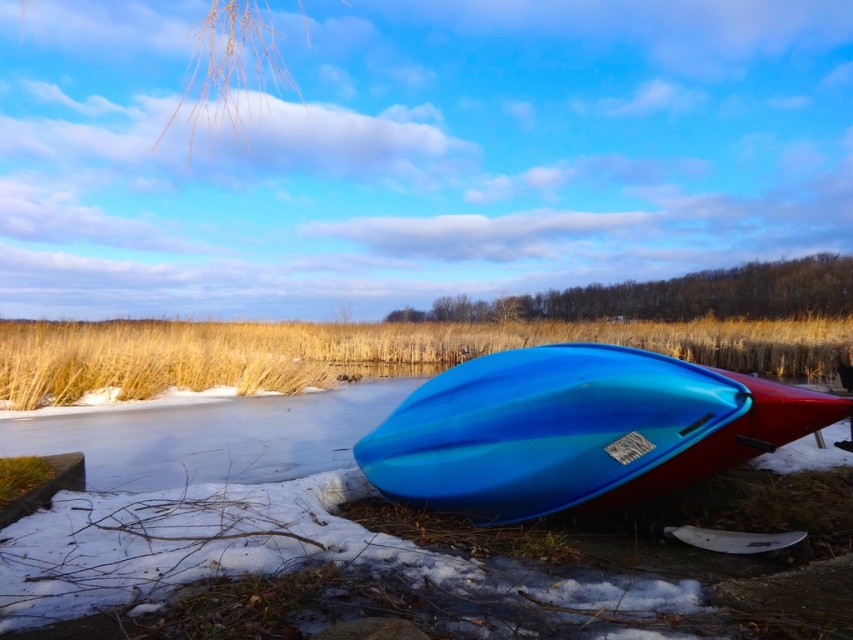
Question: Is blue glossy kayak at center positioned before golden dry grass at lower center?

Choices:
 (A) yes
 (B) no

Answer: (A)

Question: Among these objects, which one is nearest to the camera?

Choices:
 (A) blue glossy kayak at center
 (B) golden dry grass at lower center

Answer: (A)

Question: Is blue glossy kayak at center bigger than golden dry grass at lower center?

Choices:
 (A) no
 (B) yes

Answer: (A)

Question: Is blue glossy kayak at center below golden dry grass at lower center?

Choices:
 (A) yes
 (B) no

Answer: (A)

Question: Which of the following is the closest to the observer?

Choices:
 (A) 309,333
 (B) 502,378

Answer: (B)